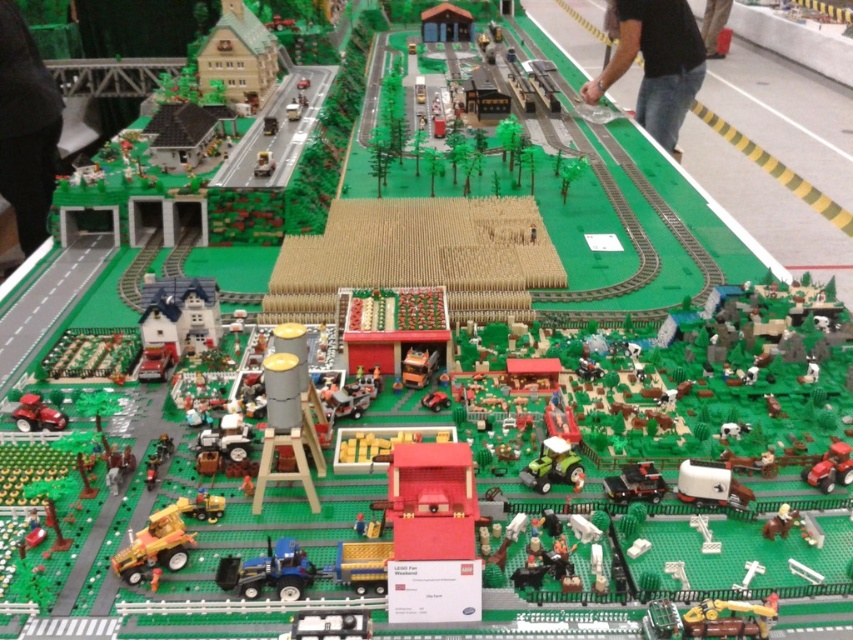
Question: Is the position of blue plastic tractor at center less distant than that of matte red tractor at lower right?

Choices:
 (A) no
 (B) yes

Answer: (B)

Question: Which object is farther from the camera taking this photo?

Choices:
 (A) metallic silver car at upper left
 (B) yellow plastic tractor at lower left

Answer: (A)

Question: Which of these objects is positioned farthest from the shiny red tractor at lower left?

Choices:
 (A) white plastic tractor at lower right
 (B) blue plastic tractor at center
 (C) matte red tractor at lower right

Answer: (C)

Question: Which of the following is the closest to the observer?

Choices:
 (A) (132, 355)
 (B) (264, 172)
 (C) (592, 100)
 (D) (607, 477)

Answer: (D)

Question: Is the position of blue plastic tractor at center less distant than that of matte red tractor at lower right?

Choices:
 (A) yes
 (B) no

Answer: (A)

Question: Is white plastic tractor at lower right positioned behind green matte tractor at center?

Choices:
 (A) yes
 (B) no

Answer: (B)